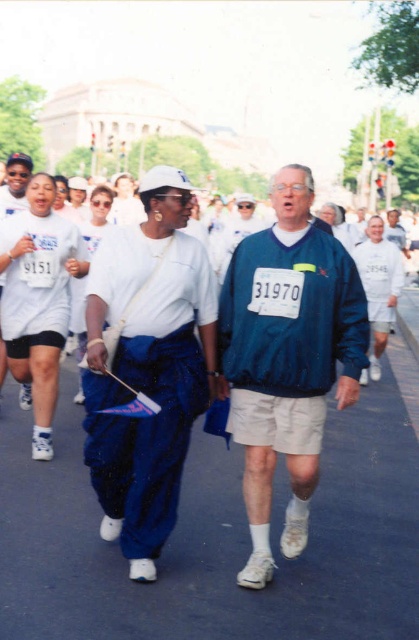
Question: Which object is closer to the camera taking this photo?

Choices:
 (A) white cotton shirt at center
 (B) white matte t-shirt at left

Answer: (A)

Question: Estimate the real-world distances between objects in this image. Which object is farther from the white matte t-shirt at left?

Choices:
 (A) blue fabric at center
 (B) white cotton t-shirt at center
 (C) white cotton shirt at center

Answer: (A)

Question: In this image, where is blue fabric jacket at center located relative to white matte t-shirt at left?

Choices:
 (A) right
 (B) left

Answer: (A)

Question: Is blue fabric at center closer to the viewer compared to white matte t-shirt at left?

Choices:
 (A) yes
 (B) no

Answer: (A)

Question: In this image, where is blue fabric at center located relative to white cotton t-shirt at center?

Choices:
 (A) above
 (B) below

Answer: (B)

Question: Which is farther from the white cotton t-shirt at center?

Choices:
 (A) white cotton shirt at center
 (B) blue fabric at center

Answer: (B)